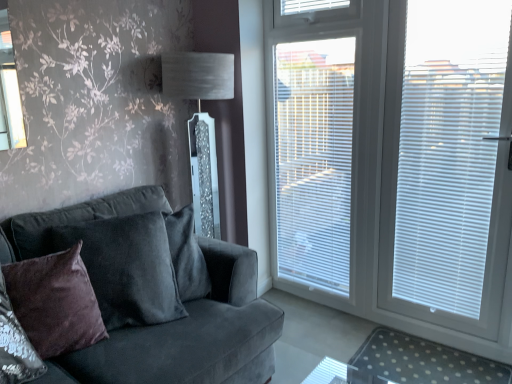
Find the location of `free region under clear polka dot mat at lower right (from a real-world perspective)`. free region under clear polka dot mat at lower right (from a real-world perspective) is located at coordinates (424, 357).